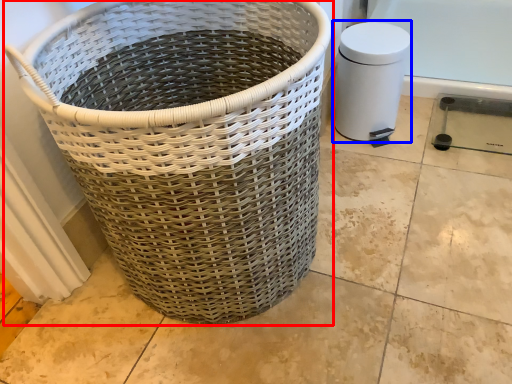
Question: Which of the following is the farthest to the observer, waste container (highlighted by a red box) or water heater (highlighted by a blue box)?

Choices:
 (A) waste container
 (B) water heater

Answer: (B)